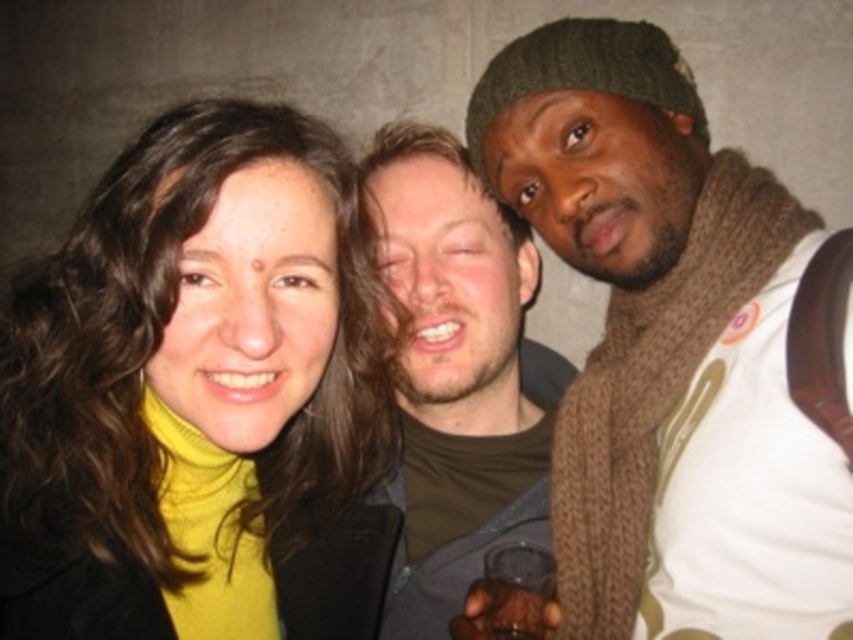
Is point (41, 308) closer to camera compared to point (461, 369)?

Yes, point (41, 308) is closer to viewer.

Can you confirm if yellow turtleneck sweater at left is taller than matte brown hair at center?

No.

Is point (154, 634) farther from viewer compared to point (425, 186)?

That is False.

Where is `yellow turtleneck sweater at left`? The image size is (853, 640). yellow turtleneck sweater at left is located at coordinates (x=193, y=387).

Can you confirm if brown knitted scarf at right is wider than matte brown hair at center?

Yes, brown knitted scarf at right is wider than matte brown hair at center.

This screenshot has width=853, height=640. What do you see at coordinates (669, 349) in the screenshot? I see `brown knitted scarf at right` at bounding box center [669, 349].

What do you see at coordinates (669, 349) in the screenshot? I see `brown knitted scarf at right` at bounding box center [669, 349].

At what (x,y) coordinates should I click in order to perform the action: click on brown knitted scarf at right. Please return your answer as a coordinate pair (x, y). Looking at the image, I should click on (669, 349).

Between yellow turtleneck sweater at left and brown knitted scarf at right, which one is positioned lower?

yellow turtleneck sweater at left

Which is in front, point (18, 348) or point (614, 477)?

Point (18, 348) is more forward.

The width and height of the screenshot is (853, 640). What are the coordinates of `yellow turtleneck sweater at left` in the screenshot? It's located at (193, 387).